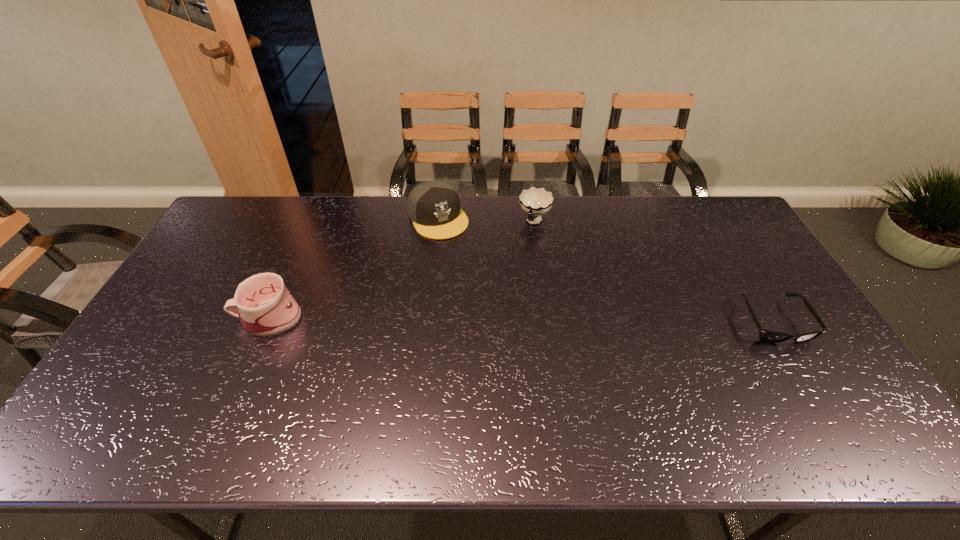
The width and height of the screenshot is (960, 540). In order to click on vacant space located on the side of the second object from right to left with the handle in this screenshot , I will do `click(519, 262)`.

In order to click on vacant region located on the side of the second object from right to left with the handle in this screenshot , I will do tap(516, 271).

The width and height of the screenshot is (960, 540). Identify the location of vacant area located 0.230m on the front-facing side of the cap. (477, 281).

At what (x,y) coordinates should I click in order to perform the action: click on vacant region located 0.300m on the front-facing side of the cap. Please return your answer as a coordinate pair (x, y). The width and height of the screenshot is (960, 540). Looking at the image, I should click on click(x=487, y=296).

This screenshot has width=960, height=540. In order to click on vacant space located 0.240m on the front-facing side of the cap in this screenshot , I will do `click(479, 284)`.

The height and width of the screenshot is (540, 960). I want to click on cup present at the far edge, so (x=535, y=202).

Identify the location of cap that is at the far edge. This screenshot has width=960, height=540. (434, 207).

At what (x,y) coordinates should I click in order to perform the action: click on object situated at the right edge. Please return your answer as a coordinate pair (x, y). This screenshot has width=960, height=540. Looking at the image, I should click on (769, 336).

Where is `free space at the far edge of the desktop`? free space at the far edge of the desktop is located at coordinates (382, 211).

Locate an element on the screen. free space at the near edge is located at coordinates (525, 402).